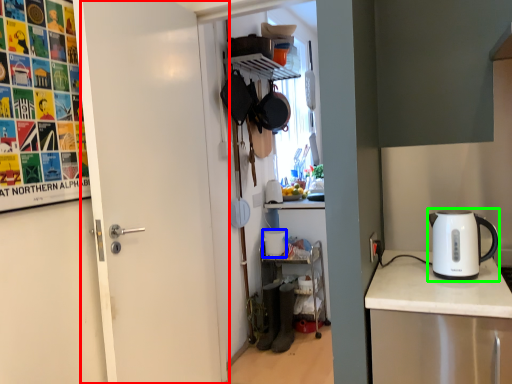
Question: Estimate the real-world distances between objects in this image. Which object is farther from door (highlighted by a red box), appliance (highlighted by a blue box) or kettle (highlighted by a green box)?

Choices:
 (A) appliance
 (B) kettle

Answer: (A)